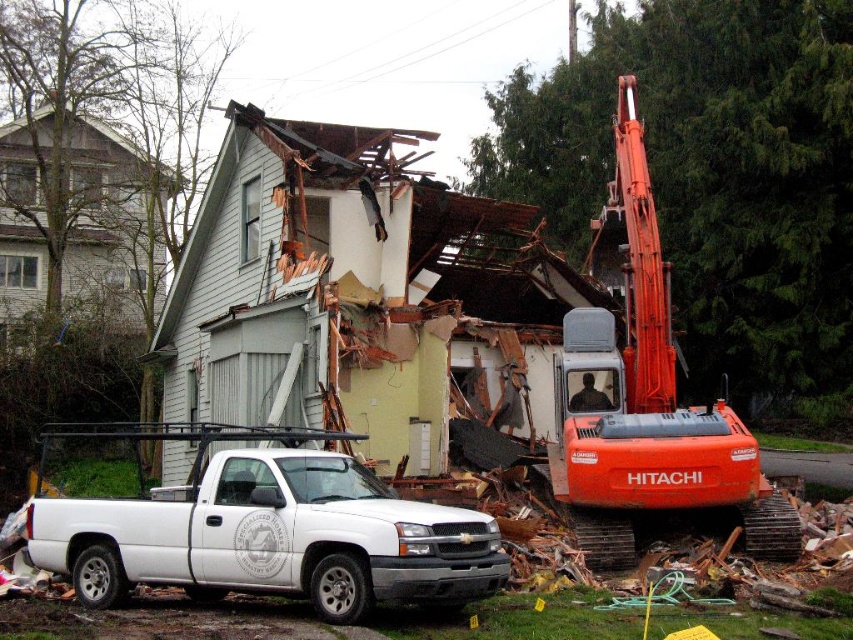
Between white matte truck at lower left and orange metallic excavator at center, which one has more height?

Standing taller between the two is orange metallic excavator at center.

Does white matte truck at lower left have a greater width compared to orange metallic excavator at center?

Yes.

I want to click on white matte truck at lower left, so pyautogui.click(x=265, y=529).

Locate an element on the screen. This screenshot has width=853, height=640. white matte truck at lower left is located at coordinates (265, 529).